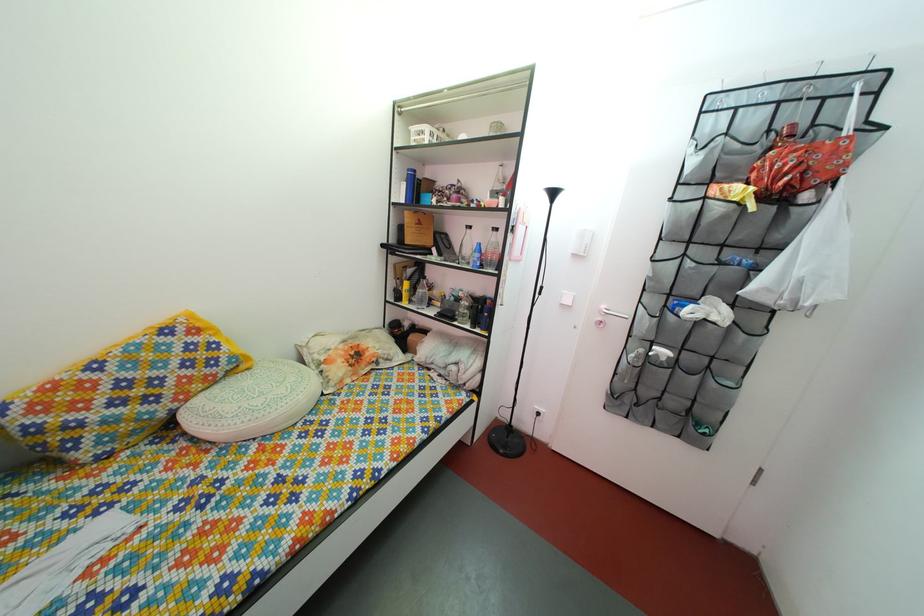
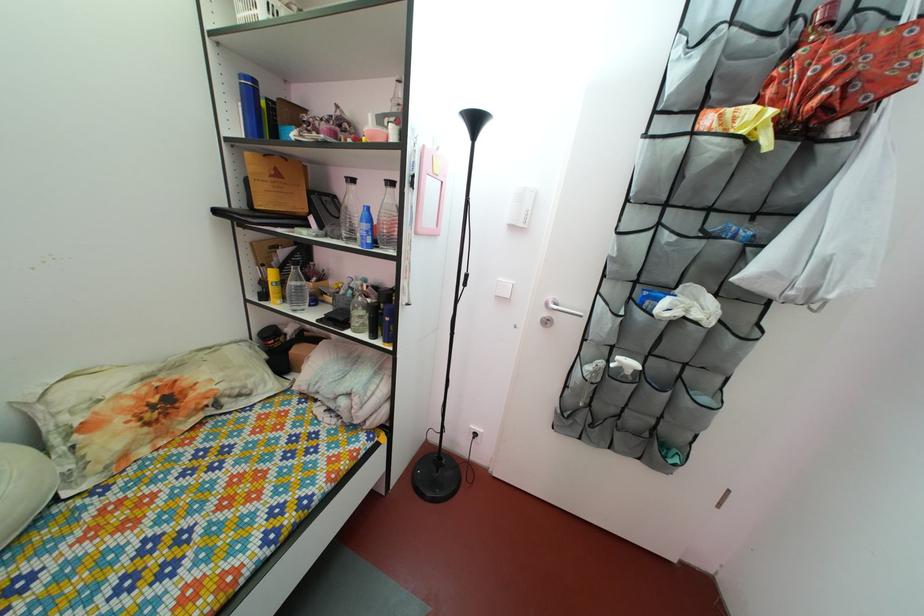
Locate, in the second image, the point that corresponds to point 460,307 in the first image.

(359, 301)